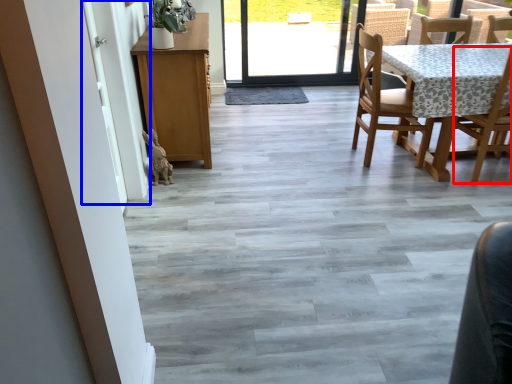
Question: Which object is closer to the camera taking this photo, chair (highlighted by a red box) or screen door (highlighted by a blue box)?

Choices:
 (A) chair
 (B) screen door

Answer: (B)